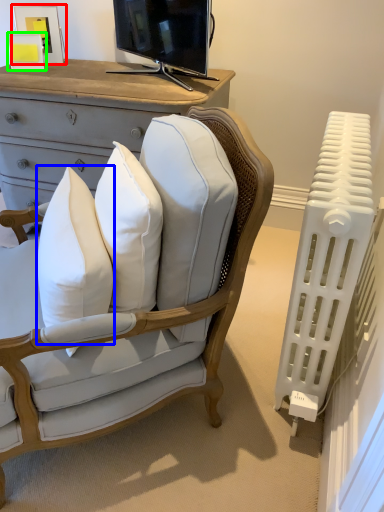
Question: Which is farther away from picture frame (highlighted by a red box)? pillow (highlighted by a blue box) or picture frame (highlighted by a green box)?

Choices:
 (A) pillow
 (B) picture frame

Answer: (A)